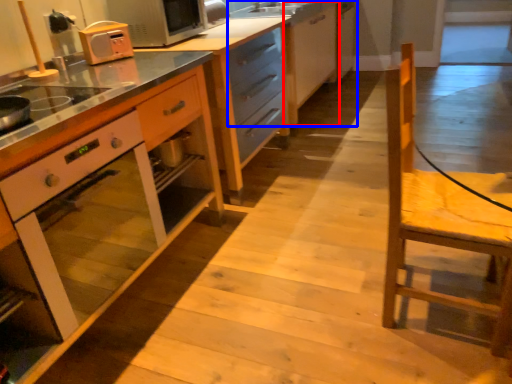
Question: Which point is closer to the camera, cabinetry (highlighted by a red box) or cabinetry (highlighted by a blue box)?

Choices:
 (A) cabinetry
 (B) cabinetry

Answer: (B)